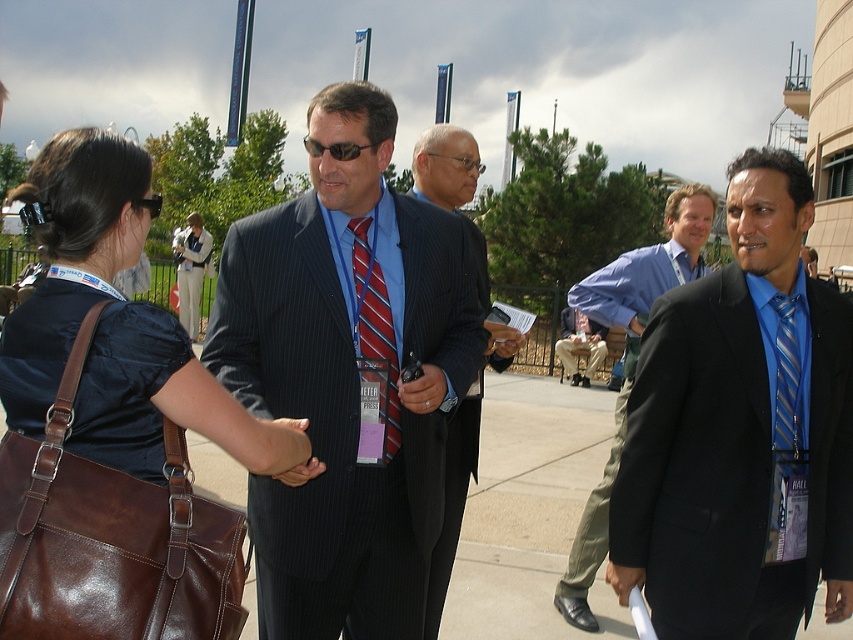
You are organizing a photo shoot and need to ensure that the dark blue pinstripe suit at center and the blue striped tie at right are visible in the frame. Given their sizes, which one might require more careful framing to avoid being too small in the photo?

The blue striped tie at right is smaller than the dark blue pinstripe suit at center, so it might require more careful framing to avoid being too small in the photo.

You are a photographer at the event and want to capture a photo that includes both the dark blue pinstripe suit at center and the blue striped tie at right. Based on their positions, which one should be placed on the left side of the photo?

The dark blue pinstripe suit at center should be placed on the left side of the photo since it is to the left of the blue striped tie at right.